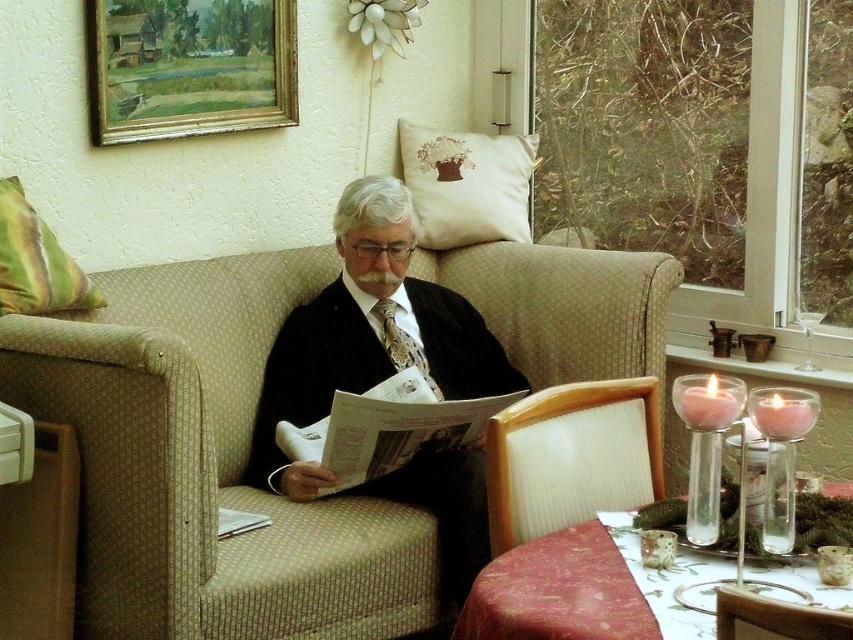
Does point (616, 488) come in front of point (67, 298)?

Yes, point (616, 488) is in front of point (67, 298).

Identify the location of white textured chair at lower right. The width and height of the screenshot is (853, 640). (572, 458).

You are a GUI agent. You are given a task and a screenshot of the screen. Output one action in this format:
    pyautogui.click(x=<x>, y=<y>)
    Task: Click on the white textured chair at lower right
    
    Given the screenshot: What is the action you would take?
    pyautogui.click(x=572, y=458)

Is white textured chair at lower right positioned behind white embroidered cushion at upper center?

That is False.

Is white textured chair at lower right smaller than white embroidered cushion at upper center?

Incorrect, white textured chair at lower right is not smaller in size than white embroidered cushion at upper center.

I want to click on white textured chair at lower right, so click(x=572, y=458).

Does beige fabric couch at center have a lesser height compared to gold-framed painting at upper left?

In fact, beige fabric couch at center may be taller than gold-framed painting at upper left.

Is beige fabric couch at center positioned at the back of gold-framed painting at upper left?

No, it is not.

Who is more forward, (485, 291) or (212, 54)?

Point (212, 54) is in front.

You are a GUI agent. You are given a task and a screenshot of the screen. Output one action in this format:
    pyautogui.click(x=<x>, y=<y>)
    Task: Click on the beige fabric couch at center
    The height and width of the screenshot is (640, 853).
    Given the screenshot: What is the action you would take?
    [x=206, y=465]